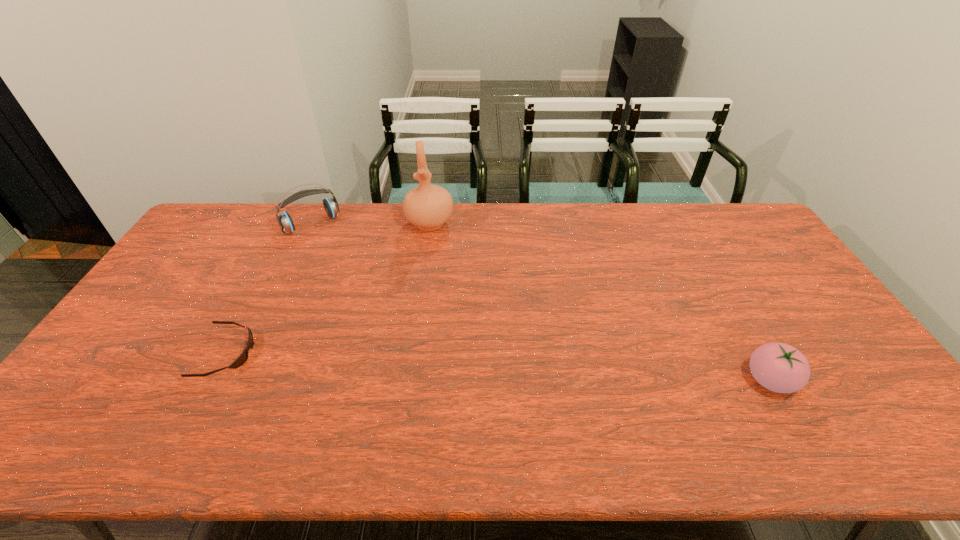
This screenshot has height=540, width=960. What are the coordinates of `vacant spot on the desktop that is between the shortest object and the rightmost object and is positioned on the ear cups of the third shortest object` in the screenshot? It's located at (412, 362).

Where is `vacant space on the desktop that is between the shortest object and the rightmost object and is positioned on the spout of the pottery`? The height and width of the screenshot is (540, 960). vacant space on the desktop that is between the shortest object and the rightmost object and is positioned on the spout of the pottery is located at coordinates (x=435, y=363).